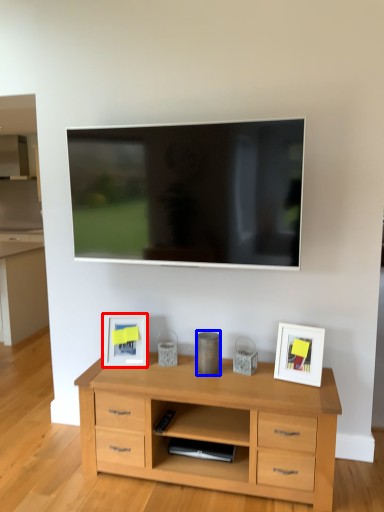
Question: Among these objects, which one is farthest to the camera, picture frame (highlighted by a red box) or appliance (highlighted by a blue box)?

Choices:
 (A) picture frame
 (B) appliance

Answer: (A)